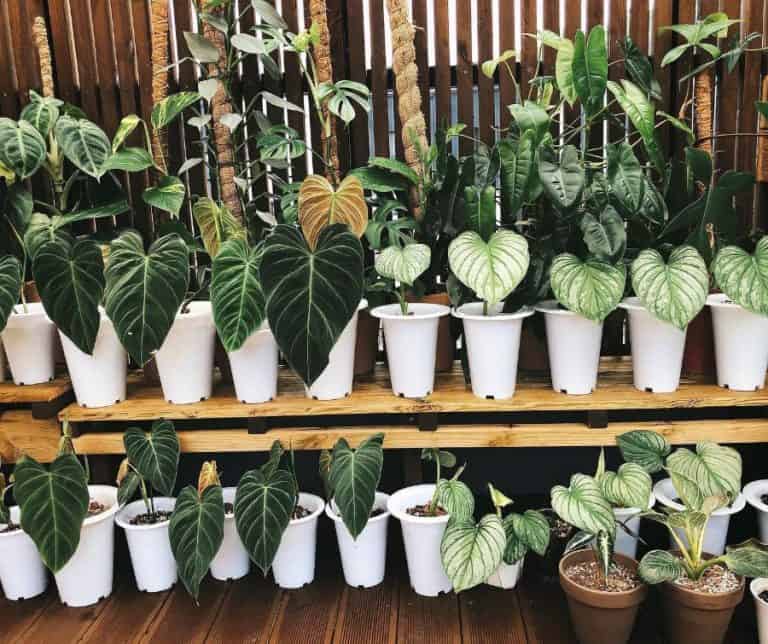
Locate an element on the screen. This screenshot has height=644, width=768. pot is located at coordinates (28, 573).